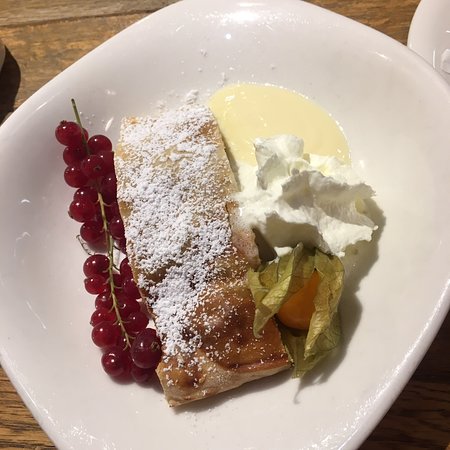
Identify the location of table. Image resolution: width=450 pixels, height=450 pixels. (1, 415), (425, 423), (45, 27), (391, 15).